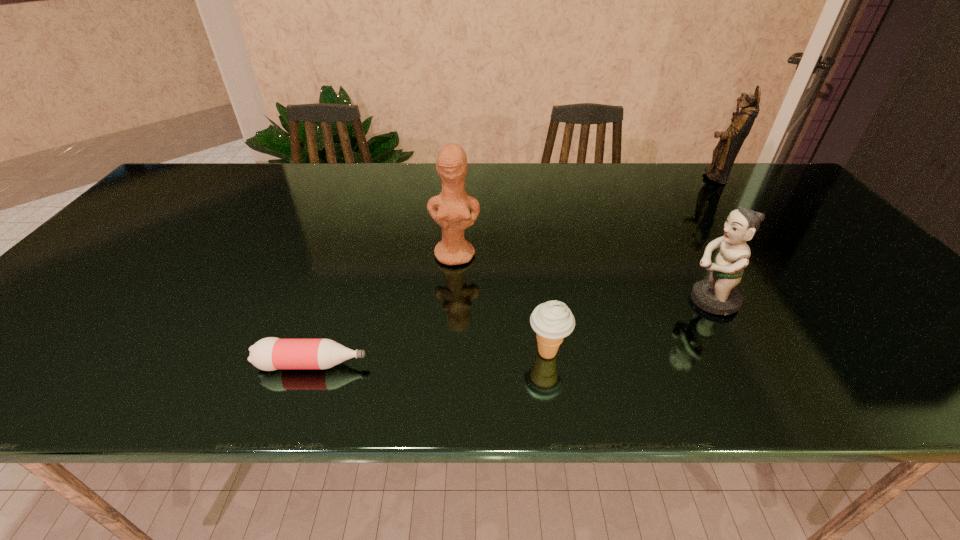
What are the coordinates of `vacant space that's between the second object from left to right and the shortest object` in the screenshot? It's located at (384, 310).

Image resolution: width=960 pixels, height=540 pixels. Find the location of `vacant area that lies between the bottle and the rightmost figurine`. vacant area that lies between the bottle and the rightmost figurine is located at coordinates (513, 271).

Where is `free space between the bottle and the third object from right to left`? This screenshot has width=960, height=540. free space between the bottle and the third object from right to left is located at coordinates (430, 359).

Locate an element on the screen. This screenshot has width=960, height=540. blank region between the shortest object and the second shortest object is located at coordinates (430, 359).

Locate an element on the screen. This screenshot has height=540, width=960. free space between the shortest figurine and the shortest object is located at coordinates (512, 333).

What are the coordinates of `free area in between the leftmost object and the third shortest object` in the screenshot? It's located at (512, 333).

At what (x,y) coordinates should I click in order to perform the action: click on free spot between the icecream and the farthest figurine. Please return your answer as a coordinate pair (x, y). The width and height of the screenshot is (960, 540). Looking at the image, I should click on (631, 265).

Identify the location of object that stands as the closest to the second figurine from left to right. The image size is (960, 540). (552, 321).

Identify which object is the closest to the fourth object from right to left. Please provide its 2D coordinates. Your answer should be formatted as a tuple, i.e. [(x, y)], where the tuple contains the x and y coordinates of a point satisfying the conditions above.

[(552, 321)]

Identify which figurine is the second nearest to the second object from right to left. Please provide its 2D coordinates. Your answer should be formatted as a tuple, i.e. [(x, y)], where the tuple contains the x and y coordinates of a point satisfying the conditions above.

[(724, 154)]